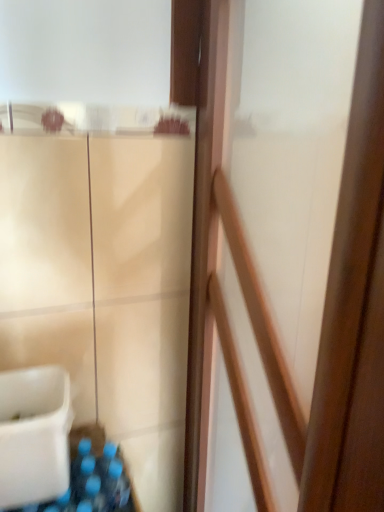
Question: Are white plastic sink at lower left and wooden screen door at center located far from each other?

Choices:
 (A) no
 (B) yes

Answer: (A)

Question: Can you confirm if white plastic sink at lower left is bigger than wooden screen door at center?

Choices:
 (A) yes
 (B) no

Answer: (B)

Question: Does white plastic sink at lower left have a lesser width compared to wooden screen door at center?

Choices:
 (A) no
 (B) yes

Answer: (A)

Question: Is white plastic sink at lower left positioned with its back to wooden screen door at center?

Choices:
 (A) no
 (B) yes

Answer: (A)

Question: Does white plastic sink at lower left touch wooden screen door at center?

Choices:
 (A) yes
 (B) no

Answer: (B)

Question: From the image's perspective, is white plastic sink at lower left on wooden screen door at center?

Choices:
 (A) yes
 (B) no

Answer: (B)

Question: Is white plastic sink at lower left surrounded by wooden screen door at center?

Choices:
 (A) no
 (B) yes

Answer: (A)

Question: Is wooden screen door at center thinner than white plastic sink at lower left?

Choices:
 (A) yes
 (B) no

Answer: (A)

Question: From a real-world perspective, is wooden screen door at center located beneath white plastic sink at lower left?

Choices:
 (A) yes
 (B) no

Answer: (B)

Question: Can you confirm if wooden screen door at center is bigger than white plastic sink at lower left?

Choices:
 (A) no
 (B) yes

Answer: (B)

Question: Would you say wooden screen door at center is outside white plastic sink at lower left?

Choices:
 (A) no
 (B) yes

Answer: (B)

Question: Are wooden screen door at center and white plastic sink at lower left beside each other?

Choices:
 (A) yes
 (B) no

Answer: (B)

Question: Is point (203, 412) closer or farther from the camera than point (56, 495)?

Choices:
 (A) farther
 (B) closer

Answer: (A)